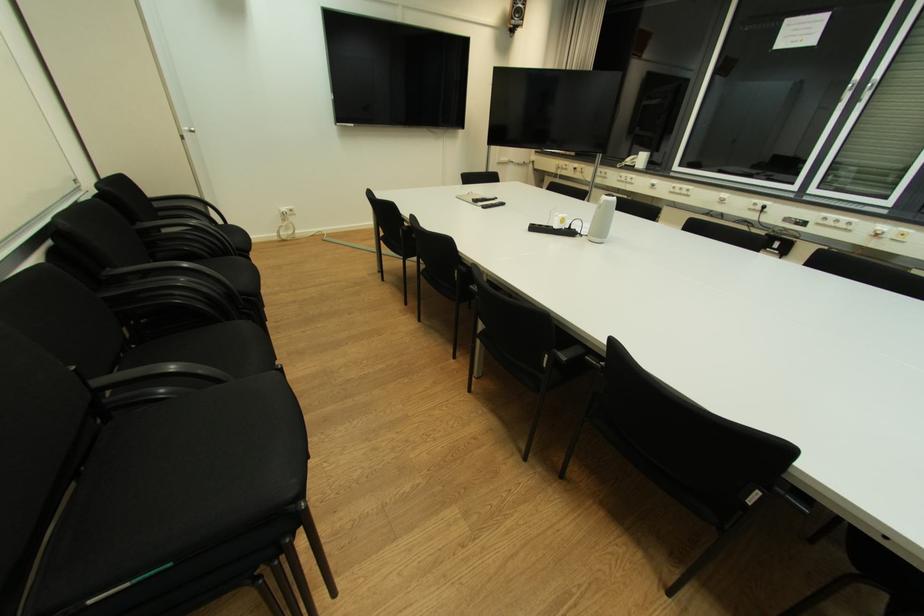
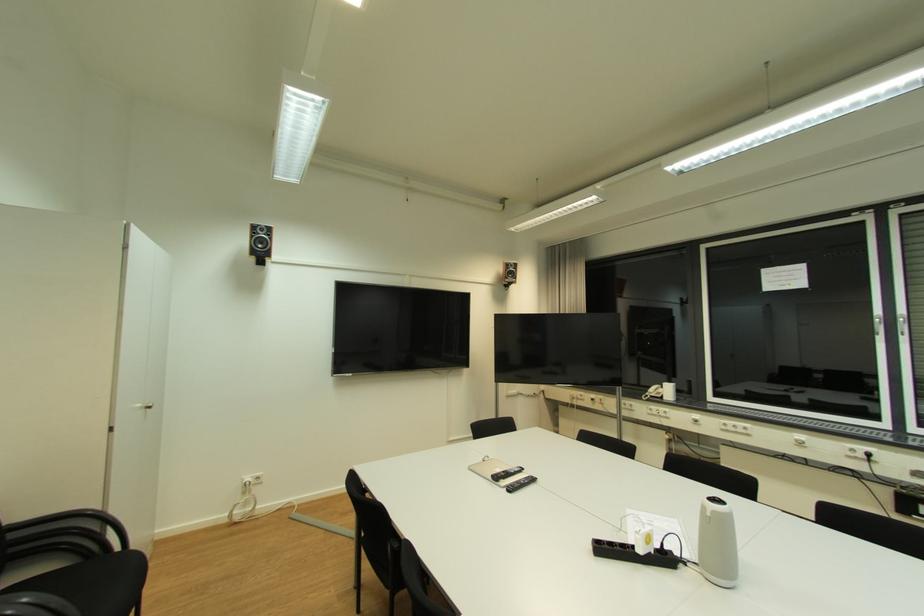
The point at (x=844, y=102) is marked in the first image. Where is the corresponding point in the second image?

(880, 334)